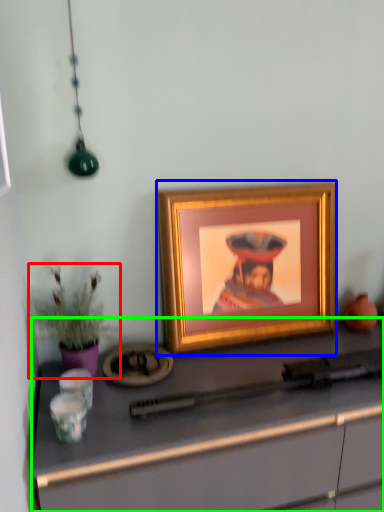
Question: Which object is positioned closest to houseplant (highlighted by a red box)? Select from picture frame (highlighted by a blue box) and desk (highlighted by a green box).

Choices:
 (A) picture frame
 (B) desk

Answer: (B)